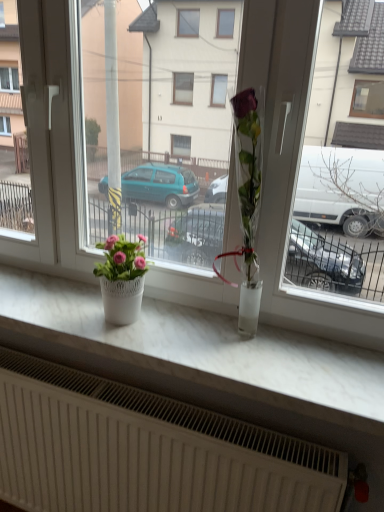
Question: Considering the relative sizes of pink matte flower pot at left and white marble counter top at center in the image provided, is pink matte flower pot at left smaller than white marble counter top at center?

Choices:
 (A) yes
 (B) no

Answer: (A)

Question: From the image's perspective, is pink matte flower pot at left above white marble counter top at center?

Choices:
 (A) no
 (B) yes

Answer: (B)

Question: Is pink matte flower pot at left at the right side of white marble counter top at center?

Choices:
 (A) no
 (B) yes

Answer: (A)

Question: Are pink matte flower pot at left and white marble counter top at center located far from each other?

Choices:
 (A) yes
 (B) no

Answer: (B)

Question: Can you see pink matte flower pot at left touching white marble counter top at center?

Choices:
 (A) yes
 (B) no

Answer: (B)

Question: Is point (117, 246) closer or farther from the camera than point (72, 342)?

Choices:
 (A) closer
 (B) farther

Answer: (A)

Question: Is pink matte flower pot at left taller or shorter than white marble counter top at center?

Choices:
 (A) tall
 (B) short

Answer: (A)

Question: In the image, is pink matte flower pot at left positioned in front of or behind white marble counter top at center?

Choices:
 (A) behind
 (B) front

Answer: (A)

Question: Which is correct: pink matte flower pot at left is inside white marble counter top at center, or outside of it?

Choices:
 (A) inside
 (B) outside

Answer: (B)

Question: Is transparent glass vase at center inside or outside of white marble counter top at center?

Choices:
 (A) outside
 (B) inside

Answer: (A)

Question: Looking at the image, does transparent glass vase at center seem bigger or smaller compared to white marble counter top at center?

Choices:
 (A) big
 (B) small

Answer: (A)

Question: Is transparent glass vase at center in front of or behind white marble counter top at center in the image?

Choices:
 (A) behind
 (B) front

Answer: (B)

Question: In terms of height, does transparent glass vase at center look taller or shorter compared to white marble counter top at center?

Choices:
 (A) tall
 (B) short

Answer: (A)

Question: From the image's perspective, relative to white textured radiator at lower center, is white marble counter top at center above or below?

Choices:
 (A) below
 (B) above

Answer: (B)

Question: In the image, is white marble counter top at center on the left side or the right side of white textured radiator at lower center?

Choices:
 (A) right
 (B) left

Answer: (A)